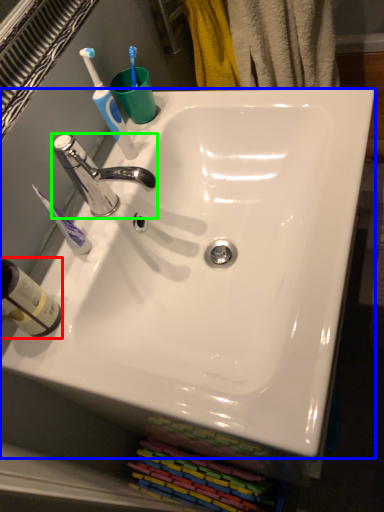
Question: Considering the real-world distances, which object is farthest from bottle (highlighted by a red box)? sink (highlighted by a blue box) or tap (highlighted by a green box)?

Choices:
 (A) sink
 (B) tap

Answer: (A)